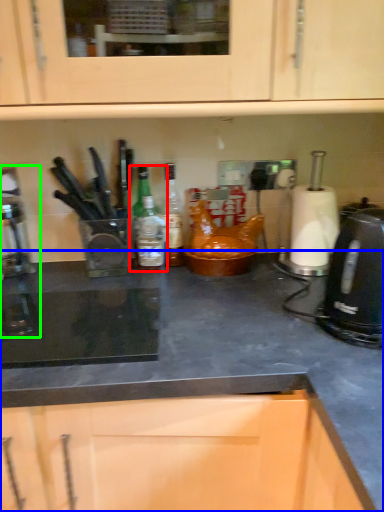
Question: Considering the real-world distances, which object is farthest from kitchen appliance (highlighted by a red box)? countertop (highlighted by a blue box) or coffee machine (highlighted by a green box)?

Choices:
 (A) countertop
 (B) coffee machine

Answer: (B)